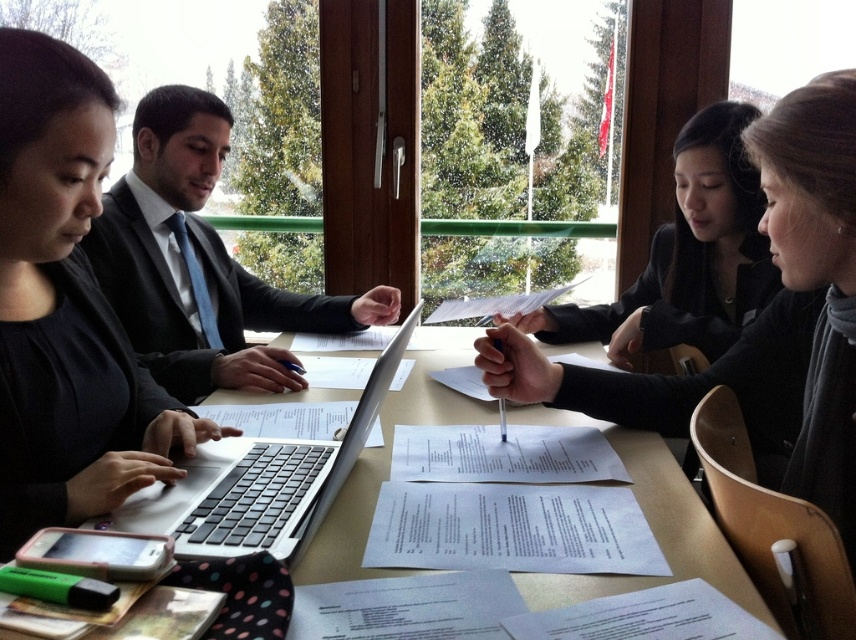
You are a participant in the meeting and want to reach for the green highlighter placed on the table. You are currently seated at the position of point (682,307). To pick it up, you need to move your hand towards point (211,509). Considering the spatial relationship between these two points, will your hand have to move closer to or further from the camera to reach the highlighter?

Since point (682,307) is further to the camera than point (211,509), your hand will need to move closer to the camera to reach the highlighter located at point (211,509).

You are a person who wants to reach the black matte jacket at upper right without moving your chair. You are currently sitting 1.2 meters away from it. Can you comfortably reach it?

The black matte jacket at upper right is 1.36 meters away from you, so you cannot comfortably reach it from your current position since it is further away than your reach of 1.2 meters.